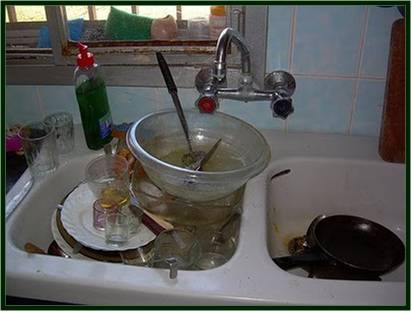
Where is `hot water knob`? The image size is (412, 312). hot water knob is located at coordinates (208, 104).